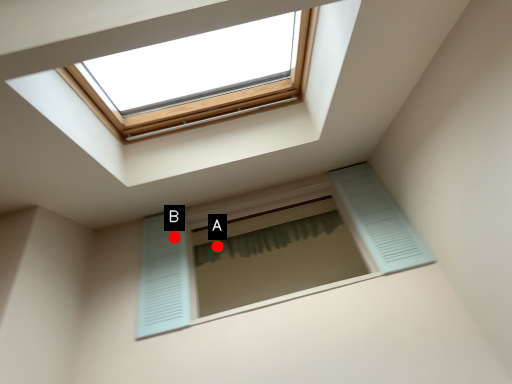
Question: Two points are circled on the image, labeled by A and B beside each circle. Which point is closer to the camera?

Choices:
 (A) A is closer
 (B) B is closer

Answer: (B)